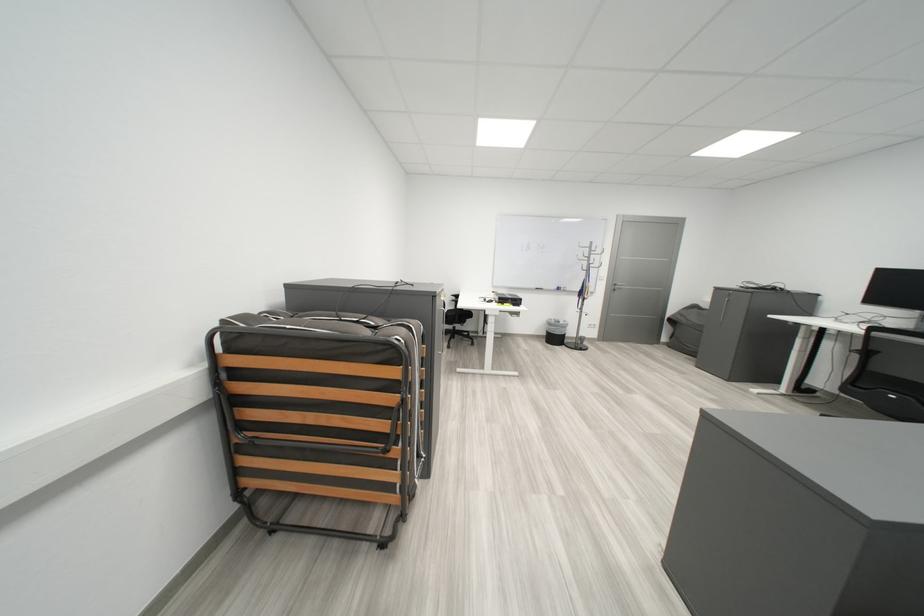
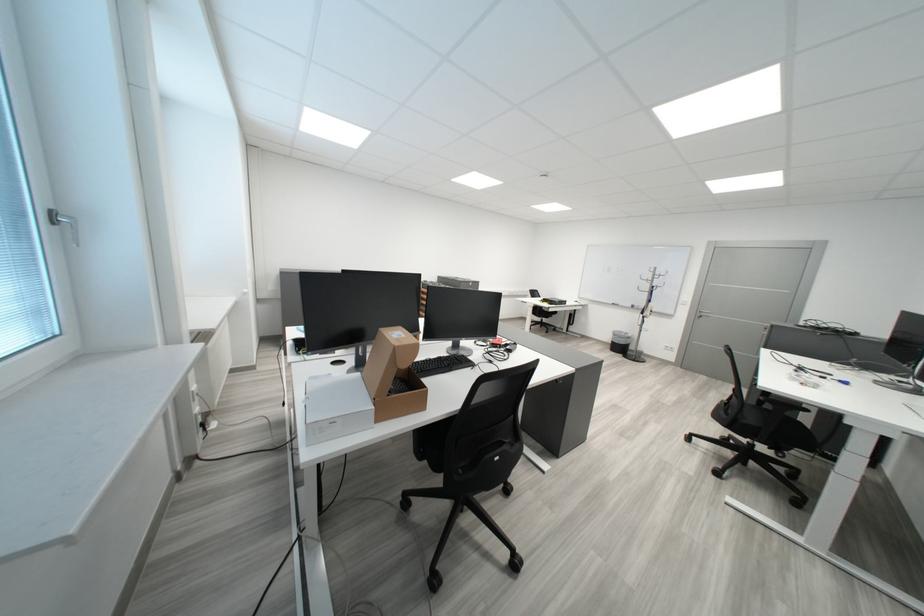
Find the pixel in the second image that matches (x=602, y=259) in the first image.

(665, 283)